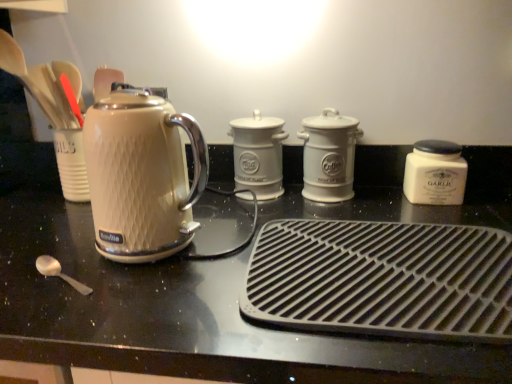
Where is `free space that is in between matte cream kettle at left and black rubber mat at center, placed as the fourth kitchen appliance when sorted from back to front`? Image resolution: width=512 pixels, height=384 pixels. free space that is in between matte cream kettle at left and black rubber mat at center, placed as the fourth kitchen appliance when sorted from back to front is located at coordinates (195, 280).